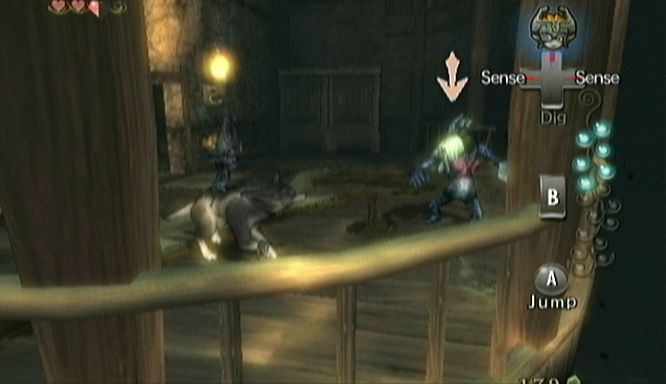
At what (x,y) coordinates should I click in order to perform the action: click on light. Please return your answer as a coordinate pair (x, y). The width and height of the screenshot is (666, 384). Looking at the image, I should click on (216, 69).